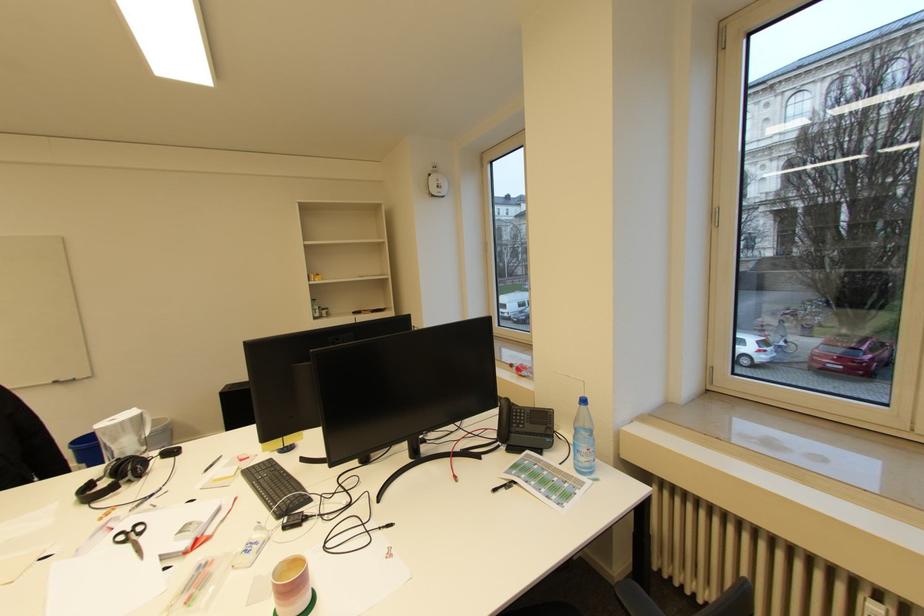
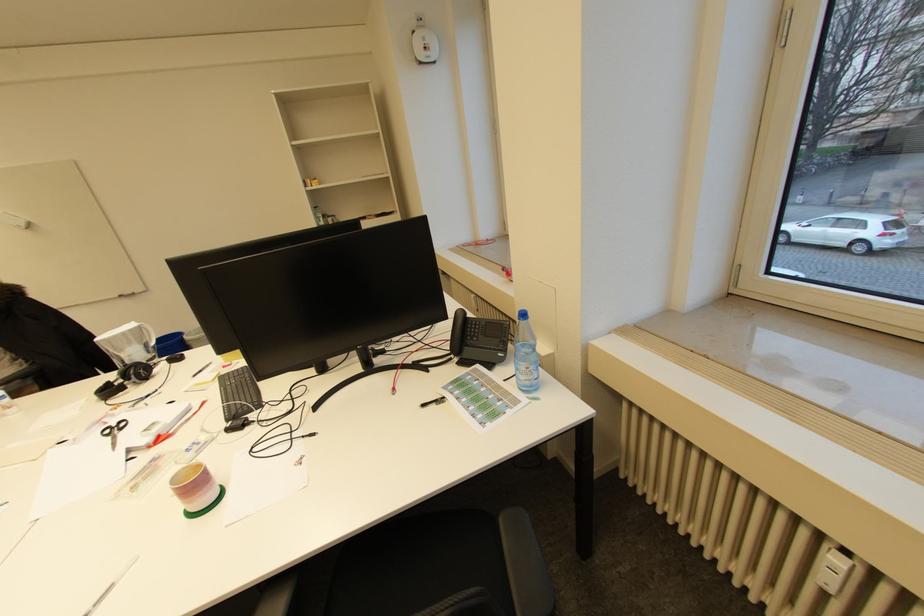
In the second image, find the point that corresponds to (592,451) in the first image.

(531, 370)